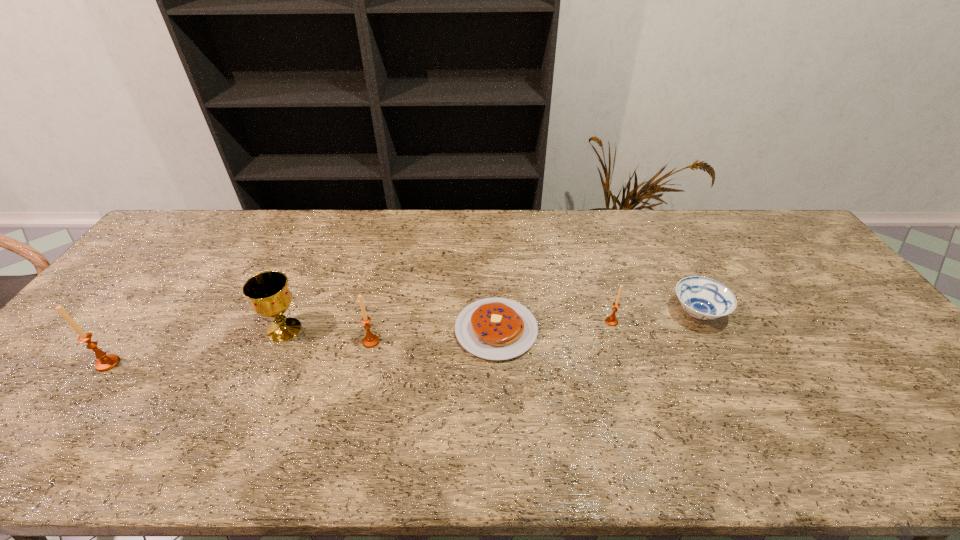
This screenshot has height=540, width=960. I want to click on the rightmost object, so click(703, 298).

Locate an element on the screen. vacant space located 0.200m on the back of the tallest candle_holder is located at coordinates (156, 300).

Where is `blank space located 0.280m on the left of the second farthest candle_holder`? blank space located 0.280m on the left of the second farthest candle_holder is located at coordinates (256, 342).

Find the location of a particular element. The width and height of the screenshot is (960, 540). vacant space located on the left of the farthest candle_holder is located at coordinates 490,322.

Identify the location of vacant space located 0.050m on the front of the second object from left to right. (271, 361).

Find the location of a particular element. The image size is (960, 540). free space located on the right of the third object from right to left is located at coordinates (593, 330).

This screenshot has width=960, height=540. What are the coordinates of `free region located 0.360m on the right of the soup bowl` in the screenshot? It's located at click(853, 313).

The height and width of the screenshot is (540, 960). What are the coordinates of `object that is at the left edge` in the screenshot? It's located at (105, 362).

Find the location of `blank space at the far edge of the desktop`. blank space at the far edge of the desktop is located at coordinates (561, 226).

Find the location of a particular element. blank space at the near edge of the desktop is located at coordinates (281, 420).